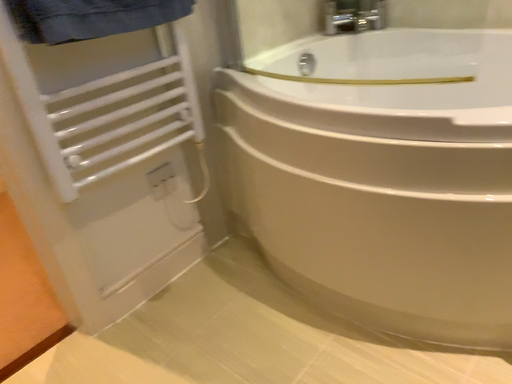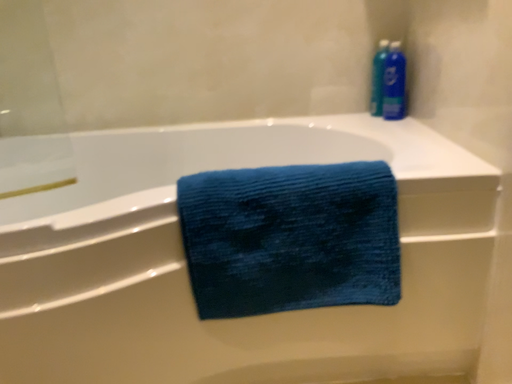
Question: How did the camera likely rotate when shooting the video?

Choices:
 (A) rotated right
 (B) rotated left

Answer: (A)